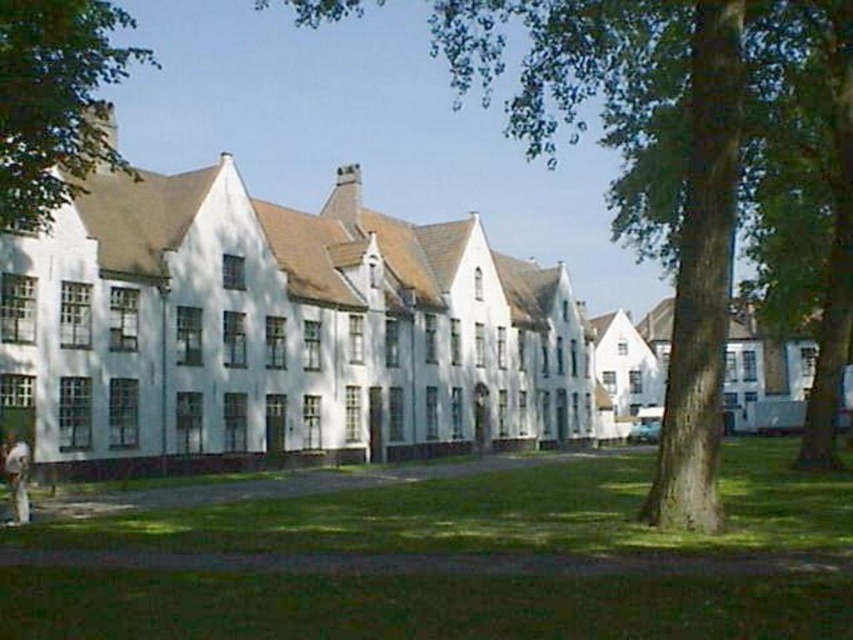
You are standing in the grassy area and want to place the light brown leather jacket at lower left under the shade of the green leafy tree at upper left. Is the jacket currently positioned under the tree?

The green leafy tree at upper left is above the light brown leather jacket at lower left, so yes, the jacket is positioned under the tree.

You are standing at the lower left corner of the image and want to walk towards the green textured tree at center. Which direction should you move relative to the light brown leather jacket at lower left?

The green textured tree at center is to the right of the light brown leather jacket at lower left, so you should move to the right relative to the light brown leather jacket at lower left to reach the tree.